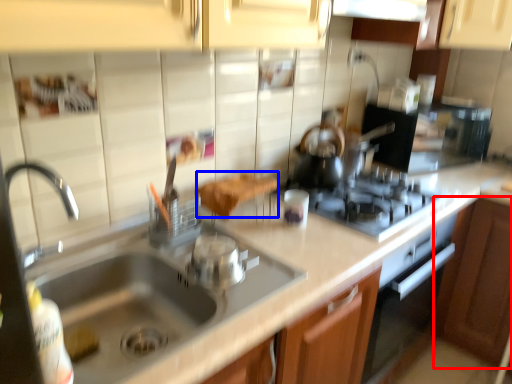
Question: Which object is closer to the camera taking this photo, cabinetry (highlighted by a red box) or food (highlighted by a blue box)?

Choices:
 (A) cabinetry
 (B) food

Answer: (B)